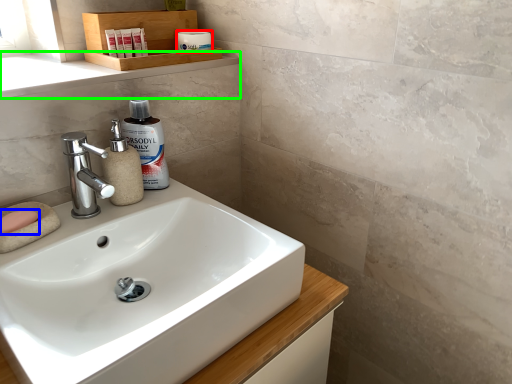
Question: Which object is the farthest from toiletry (highlighted by a red box)? Choose among these: soap (highlighted by a blue box) or window sill (highlighted by a green box).

Choices:
 (A) soap
 (B) window sill

Answer: (A)